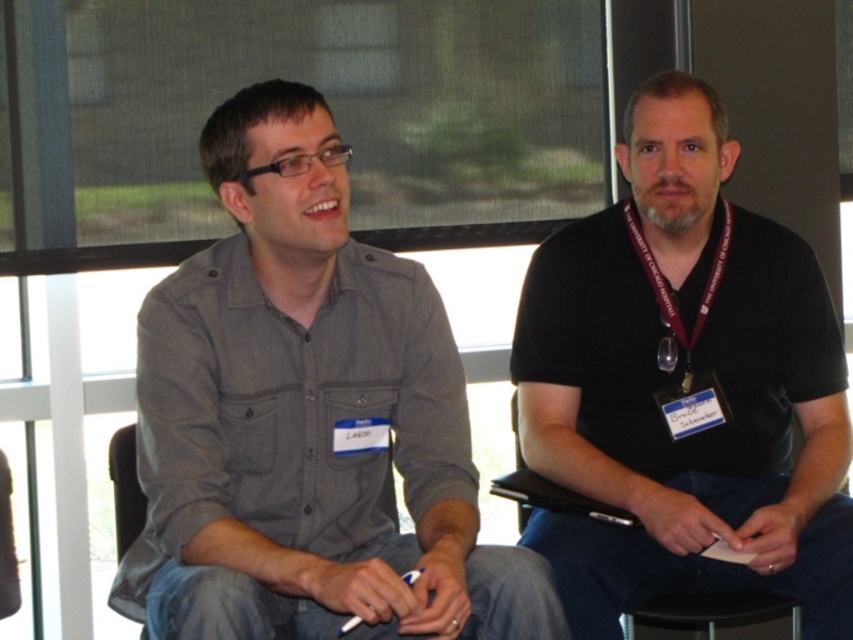
Question: Which point is farther to the camera?

Choices:
 (A) (598, 432)
 (B) (239, 397)
 (C) (689, 385)

Answer: (A)

Question: Does black matte shirt at center have a larger size compared to matte gray shirt at center?

Choices:
 (A) no
 (B) yes

Answer: (B)

Question: Which object appears farthest from the camera in this image?

Choices:
 (A) gray cotton shirt at left
 (B) matte gray shirt at center
 (C) black matte shirt at center
 (D) black fabric lanyard at center

Answer: (D)

Question: Is matte gray shirt at center closer to the viewer compared to black fabric lanyard at center?

Choices:
 (A) no
 (B) yes

Answer: (B)

Question: Can you confirm if matte gray shirt at center is positioned above black fabric lanyard at center?

Choices:
 (A) yes
 (B) no

Answer: (A)

Question: Which of these objects is positioned farthest from the black matte shirt at center?

Choices:
 (A) matte gray shirt at center
 (B) gray cotton shirt at left
 (C) black fabric lanyard at center

Answer: (A)